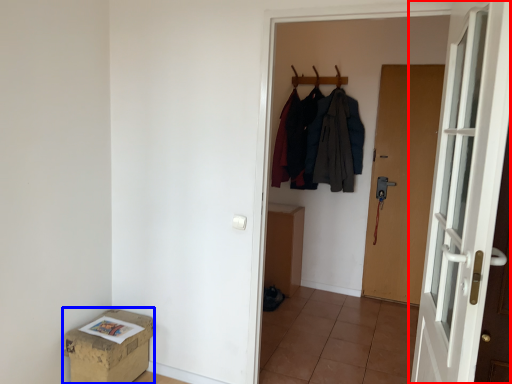
Question: Which object is further to the camera taking this photo, door (highlighted by a red box) or box (highlighted by a blue box)?

Choices:
 (A) door
 (B) box

Answer: (B)